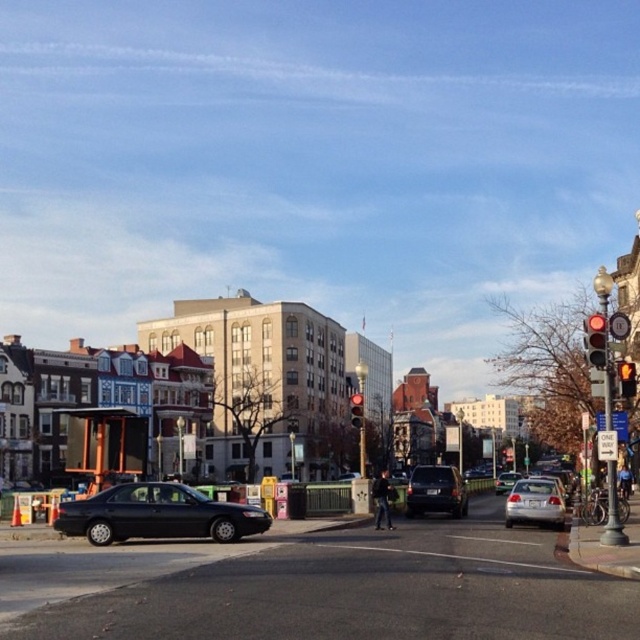
Is point (360, 412) closer to camera compared to point (509, 490)?

Yes, point (360, 412) is closer to viewer.

Locate an element on the screen. The width and height of the screenshot is (640, 640). red glass traffic light at center is located at coordinates (356, 410).

Who is positioned more to the left, black matte sedan at lower left or red glass traffic light at center?

Positioned to the left is black matte sedan at lower left.

Is point (611, 636) closer to viewer compared to point (356, 400)?

Yes, it is.

This screenshot has height=640, width=640. Describe the element at coordinates (364, 592) in the screenshot. I see `black matte sedan at lower left` at that location.

The image size is (640, 640). I want to click on black matte sedan at lower left, so click(364, 592).

Is point (148, 593) more distant than point (604, 348)?

That is False.

Does black matte sedan at lower left come behind red glass traffic light at upper right?

That is False.

Is point (248, 609) closer to viewer compared to point (600, 342)?

That is True.

You are a GUI agent. You are given a task and a screenshot of the screen. Output one action in this format:
    pyautogui.click(x=<x>, y=<y>)
    Task: Click on the black matte sedan at lower left
    The height and width of the screenshot is (640, 640).
    Given the screenshot: What is the action you would take?
    pos(364,592)